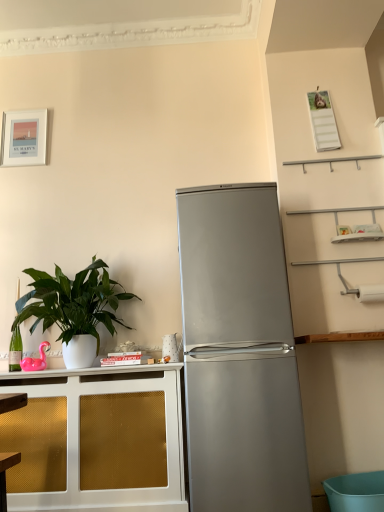
Question: Is green glossy plant at left smaller than satin silver refrigerator at center?

Choices:
 (A) no
 (B) yes

Answer: (B)

Question: Is green glossy plant at left facing away from satin silver refrigerator at center?

Choices:
 (A) no
 (B) yes

Answer: (A)

Question: Can you confirm if green glossy plant at left is bigger than satin silver refrigerator at center?

Choices:
 (A) no
 (B) yes

Answer: (A)

Question: From the image's perspective, is green glossy plant at left below satin silver refrigerator at center?

Choices:
 (A) yes
 (B) no

Answer: (B)

Question: Considering the relative positions of green glossy plant at left and satin silver refrigerator at center in the image provided, is green glossy plant at left to the right of satin silver refrigerator at center from the viewer's perspective?

Choices:
 (A) no
 (B) yes

Answer: (A)

Question: From the image's perspective, is gold mesh cabinet at left positioned above or below silver metallic refrigerator at center?

Choices:
 (A) below
 (B) above

Answer: (A)

Question: Considering the positions of gold mesh cabinet at left and silver metallic refrigerator at center in the image, is gold mesh cabinet at left bigger or smaller than silver metallic refrigerator at center?

Choices:
 (A) small
 (B) big

Answer: (B)

Question: Is gold mesh cabinet at left to the left or to the right of silver metallic refrigerator at center in the image?

Choices:
 (A) left
 (B) right

Answer: (A)

Question: From a real-world perspective, relative to silver metallic refrigerator at center, is gold mesh cabinet at left vertically above or below?

Choices:
 (A) below
 (B) above

Answer: (A)

Question: From their relative heights in the image, would you say gold mesh cabinet at left is taller or shorter than satin silver refrigerator at center?

Choices:
 (A) short
 (B) tall

Answer: (A)

Question: Based on their positions, is gold mesh cabinet at left located to the left or right of satin silver refrigerator at center?

Choices:
 (A) right
 (B) left

Answer: (B)

Question: Does point (107, 475) appear closer or farther from the camera than point (190, 218)?

Choices:
 (A) farther
 (B) closer

Answer: (A)

Question: Relative to satin silver refrigerator at center, is gold mesh cabinet at left in front or behind?

Choices:
 (A) front
 (B) behind

Answer: (B)

Question: In terms of width, does satin silver refrigerator at center look wider or thinner when compared to matte white picture frame at upper left?

Choices:
 (A) thin
 (B) wide

Answer: (B)

Question: From a real-world perspective, is satin silver refrigerator at center above or below matte white picture frame at upper left?

Choices:
 (A) above
 (B) below

Answer: (B)